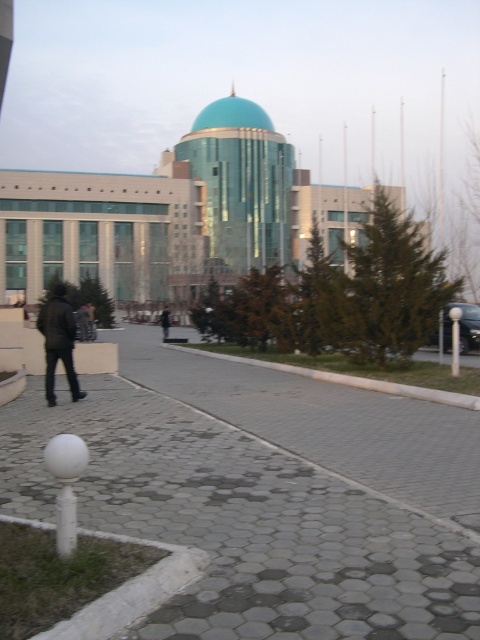
Question: Among these objects, which one is farthest from the camera?

Choices:
 (A) dark brown leather jacket at left
 (B) gray hexagonal paving at center

Answer: (A)

Question: Can you confirm if dark brown leather jacket at left is thinner than black leather jacket at center?

Choices:
 (A) yes
 (B) no

Answer: (B)

Question: Does gray hexagonal paving at center have a lesser width compared to black leather jacket at center?

Choices:
 (A) yes
 (B) no

Answer: (B)

Question: Does gray hexagonal paving at center have a greater width compared to dark brown leather jacket at left?

Choices:
 (A) yes
 (B) no

Answer: (B)

Question: Considering the real-world distances, which object is closest to the dark brown leather jacket at left?

Choices:
 (A) black leather jacket at center
 (B) gray hexagonal paving at center

Answer: (B)

Question: Which object is farther from the camera taking this photo?

Choices:
 (A) gray hexagonal paving at center
 (B) dark brown leather jacket at left
 (C) black leather jacket at center

Answer: (C)